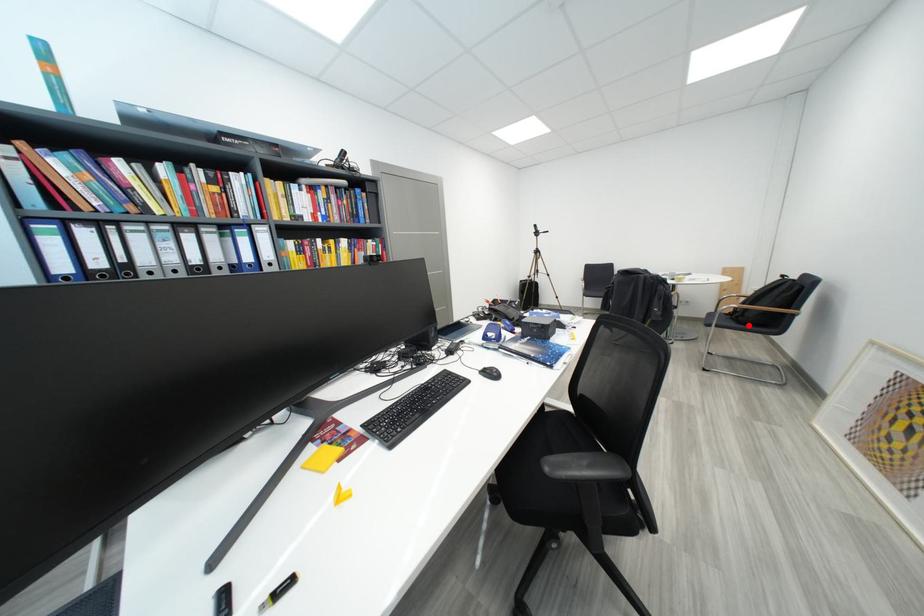
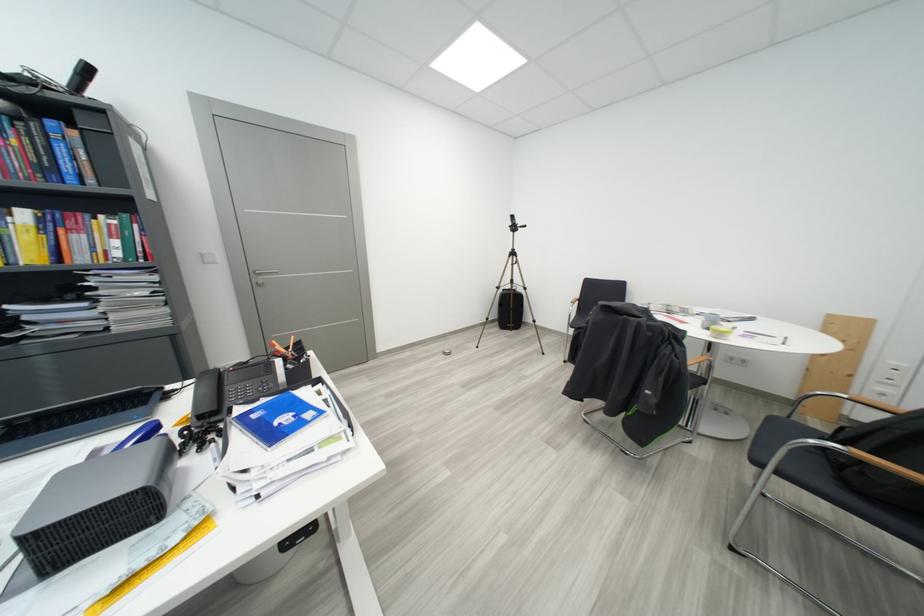
Where in the second image is the point corresponding to the highlighted location from the first image?

(856, 487)